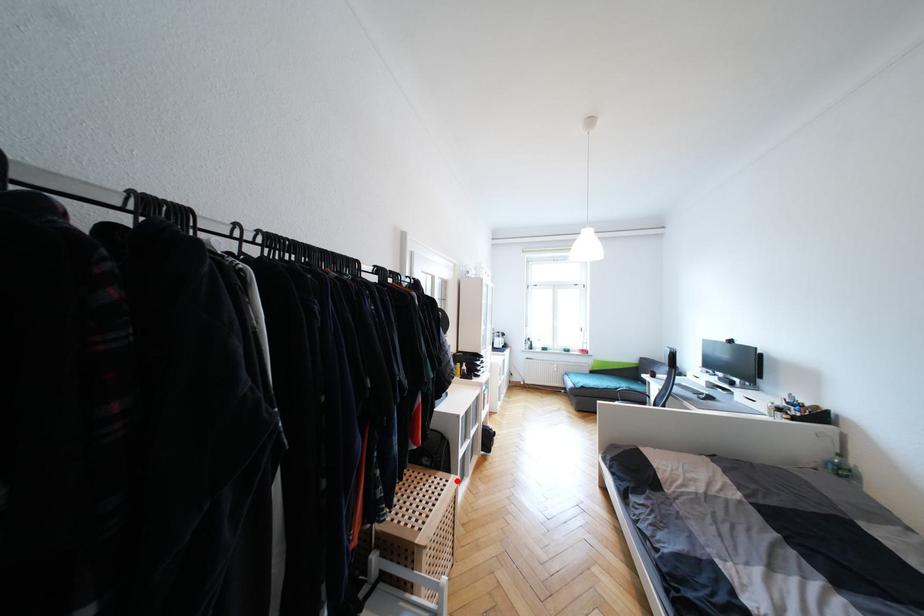
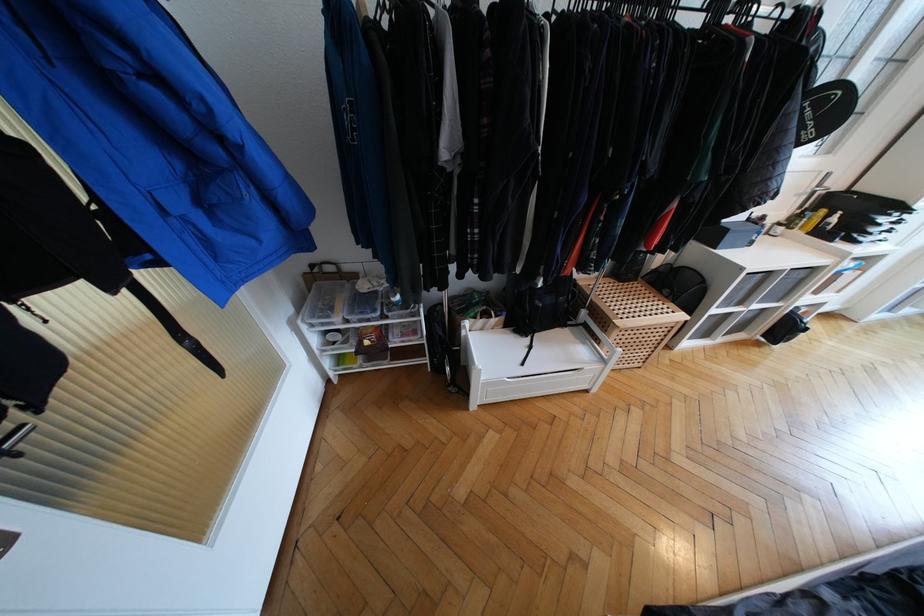
Find the pixel in the second image that matches the highlighted location in the first image.

(685, 317)